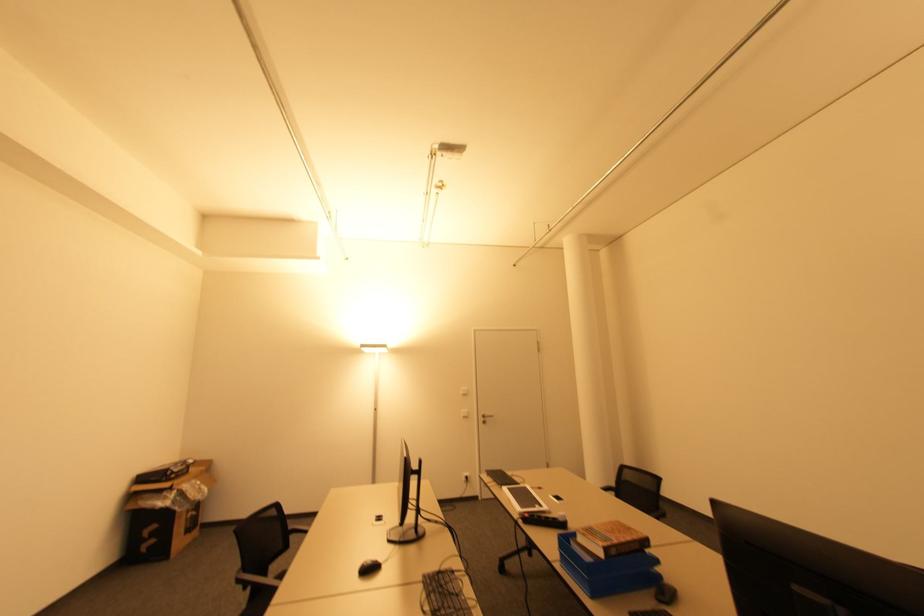
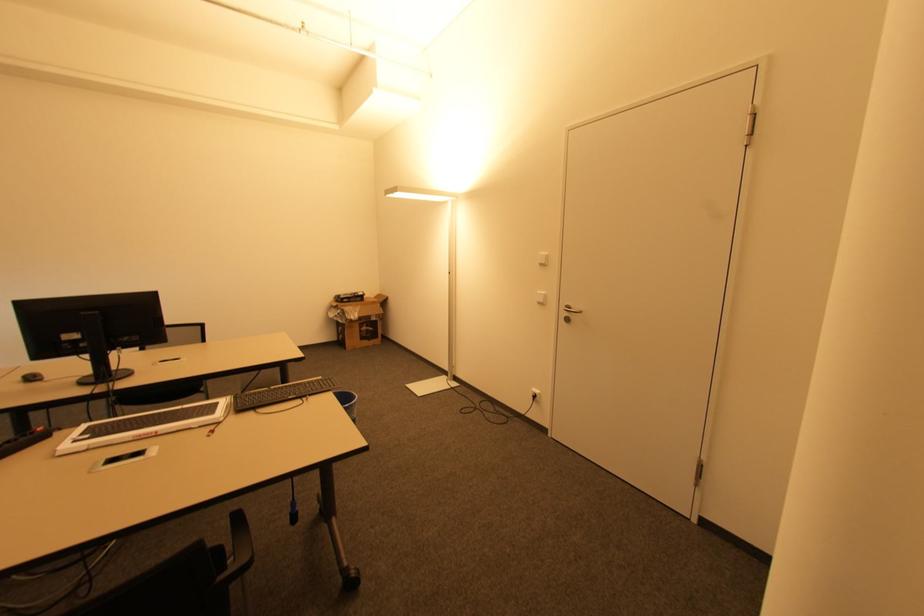
Find the pixel in the second image that matches point (468, 474) in the first image.

(539, 392)